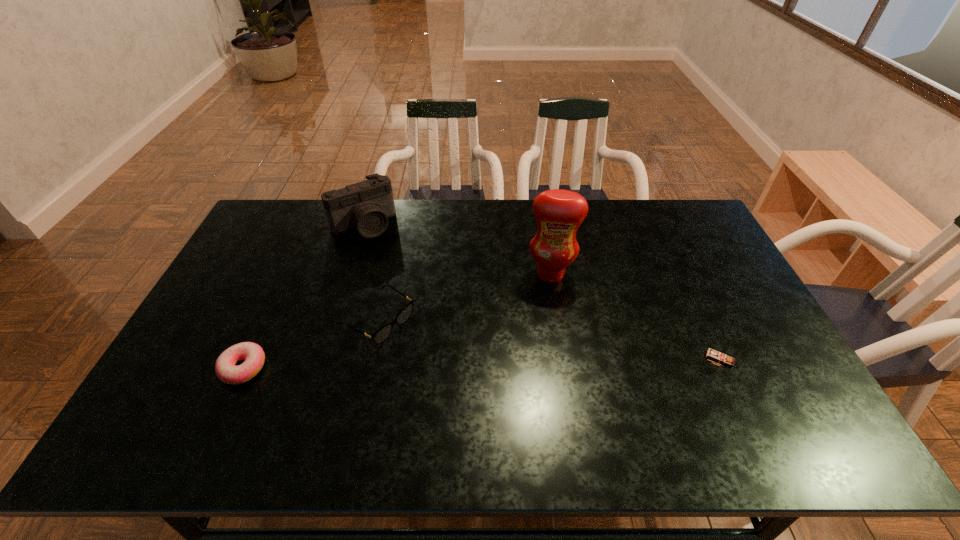
You are a GUI agent. You are given a task and a screenshot of the screen. Output one action in this format:
    pyautogui.click(x=<x>, y=<y>)
    Task: Click on the object that stands as the third closest to the second farthest object
    
    Given the screenshot: What is the action you would take?
    pyautogui.click(x=366, y=206)

Locate an element on the screen. the second closest object to the doughnut is located at coordinates (366, 206).

Identify the location of free space that satisfies the following two spatial constraints: 1. on the back side of the farthest object; 2. on the right side of the leftmost object. The height and width of the screenshot is (540, 960). (308, 225).

Where is `vacant area that satisfies the following two spatial constraints: 1. on the front side of the condiment; 2. on the right side of the fourth shortest object`? The image size is (960, 540). vacant area that satisfies the following two spatial constraints: 1. on the front side of the condiment; 2. on the right side of the fourth shortest object is located at coordinates pyautogui.click(x=348, y=274).

Locate an element on the screen. The width and height of the screenshot is (960, 540). vacant space that satisfies the following two spatial constraints: 1. on the back side of the shortest object; 2. on the right side of the camera is located at coordinates (308, 225).